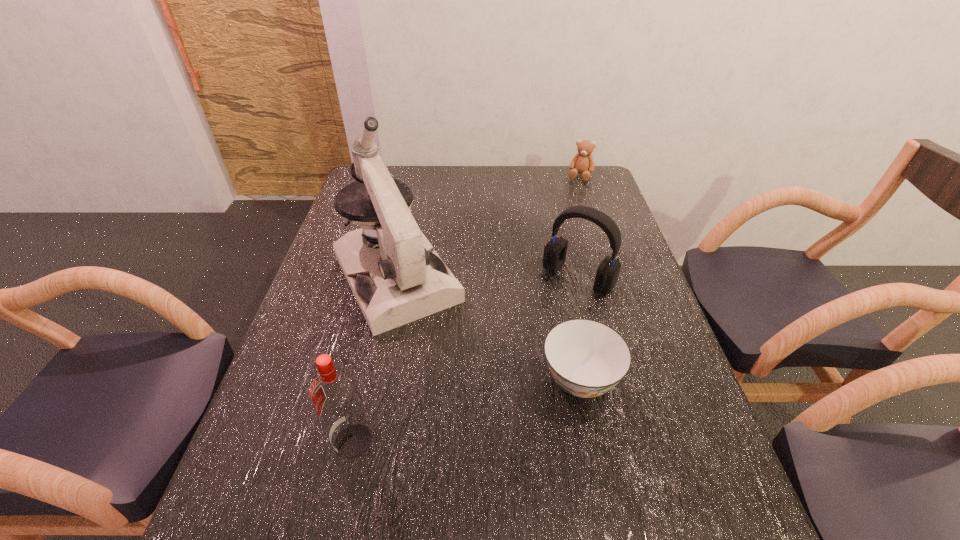
Identify the location of vacant space on the desktop that is between the fourth shortest object and the soup bowl and is positioned on the headband of the headset. (473, 408).

Locate an element on the screen. The image size is (960, 540). vacant space on the desktop that is between the fourth shortest object and the fourth farthest object and is positioned on the front-facing side of the teddy bear is located at coordinates 493,403.

The image size is (960, 540). I want to click on free space on the desktop that is between the vodka and the fourth farthest object and is positioned at the eyepiece of the microscope, so click(475, 408).